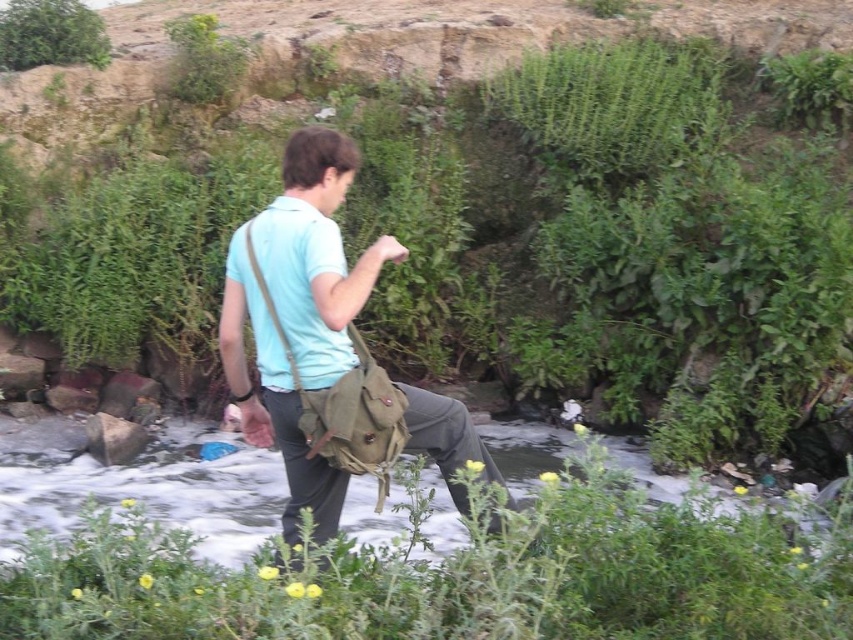
What do you see at coordinates (457, 576) in the screenshot?
I see `green leafy plant at center` at bounding box center [457, 576].

Measure the distance between green leafy plant at center and green leafy bush at upper left.

green leafy plant at center and green leafy bush at upper left are 26.46 feet apart from each other.

Who is more distant from viewer, (717,548) or (61,42)?

The point (61,42) is behind.

Image resolution: width=853 pixels, height=640 pixels. Find the location of `green leafy plant at center`. green leafy plant at center is located at coordinates pyautogui.click(x=457, y=576).

Find the location of `green leafy plants at center`. green leafy plants at center is located at coordinates (490, 212).

Is point (840, 339) farther from camera compared to point (338, 170)?

Yes, point (840, 339) is behind point (338, 170).

This screenshot has width=853, height=640. I want to click on green leafy plants at center, so click(490, 212).

Locate an element on the screen. This screenshot has width=853, height=640. green leafy plant at center is located at coordinates (457, 576).

At what (x,y) coordinates should I click in order to perform the action: click on green leafy plant at center. Please return your answer as a coordinate pair (x, y). Looking at the image, I should click on (457, 576).

Where is `green leafy plant at center`? This screenshot has width=853, height=640. green leafy plant at center is located at coordinates (457, 576).